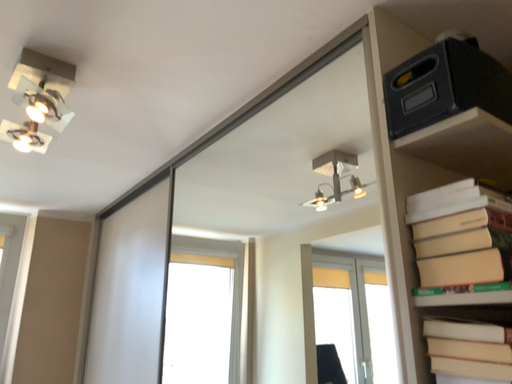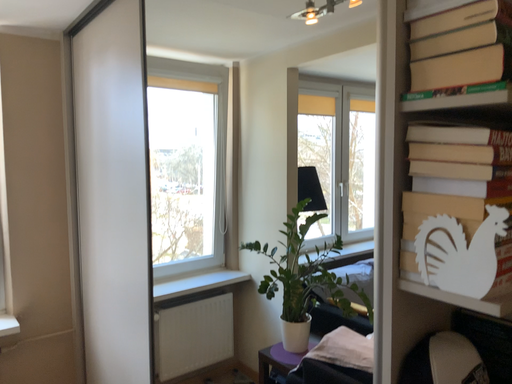
Question: How did the camera likely rotate when shooting the video?

Choices:
 (A) rotated upward
 (B) rotated downward

Answer: (B)